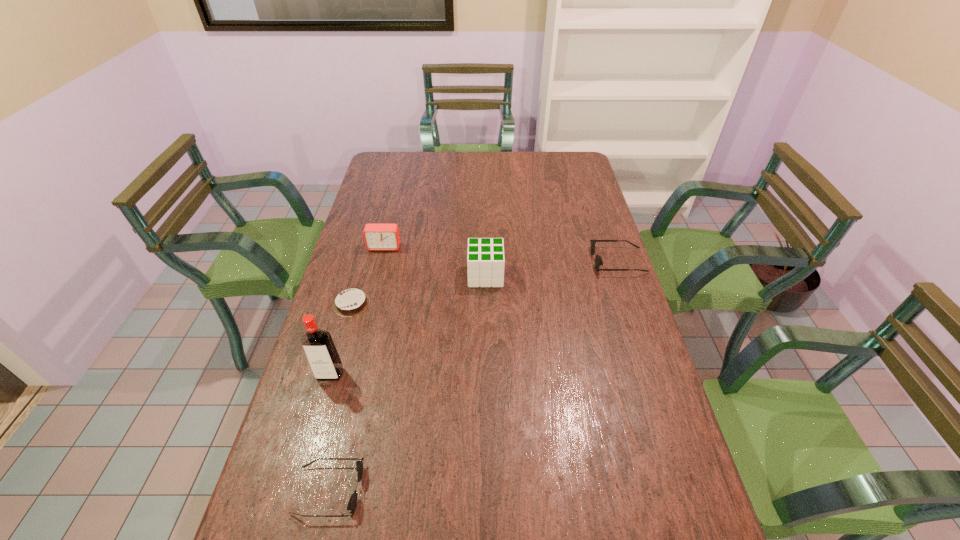
The width and height of the screenshot is (960, 540). Identify the location of vacant area that satisfies the following two spatial constraints: 1. on the red face of the second tallest object; 2. on the front side of the chocolate cake. (486, 304).